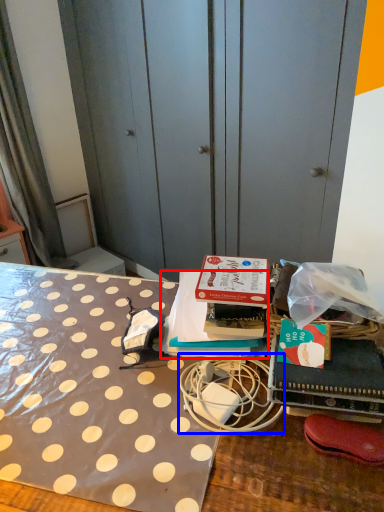
Question: Among these objects, which one is farthest to the camera, book (highlighted by a red box) or twin (highlighted by a blue box)?

Choices:
 (A) book
 (B) twin

Answer: (A)